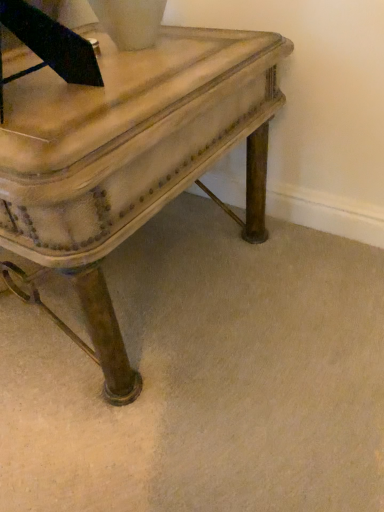
What is the approximate width of wooden table at center?

It is 29.25 inches.

Looking at this image, in order to face wooden table at center, should I rotate leftwards or rightwards?

It's best to rotate left around 12.167 degrees.

This screenshot has height=512, width=384. Identify the location of wooden table at center. (130, 157).

This screenshot has width=384, height=512. What do you see at coordinates (130, 157) in the screenshot?
I see `wooden table at center` at bounding box center [130, 157].

The height and width of the screenshot is (512, 384). Identify the location of wooden table at center. (130, 157).